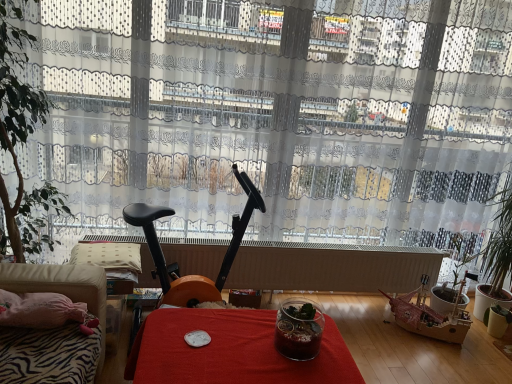
Question: In terms of height, does black plastic exercise bike at center look taller or shorter compared to red fabric table at center?

Choices:
 (A) short
 (B) tall

Answer: (B)

Question: Is point (138, 215) positioned closer to the camera than point (312, 379)?

Choices:
 (A) farther
 (B) closer

Answer: (A)

Question: Estimate the real-world distances between objects in this image. Which object is closer to the green leafy plant at right, positioned as the 2th houseplant in top-to-bottom order?

Choices:
 (A) transparent glass jar at center
 (B) red fabric table at center
 (C) white matte radiator at center
 (D) green leafy plant at left, the 2th houseplant in the right-to-left sequence
 (E) velvet beige couch at lower left

Answer: (C)

Question: Which object is the closest to the black plastic exercise bike at center?

Choices:
 (A) green leafy plant at left, which is the 1th houseplant in left-to-right order
 (B) transparent glass jar at center
 (C) green leafy plant at right, the 2th houseplant viewed from the front
 (D) white matte radiator at center
 (E) red fabric table at center

Answer: (D)